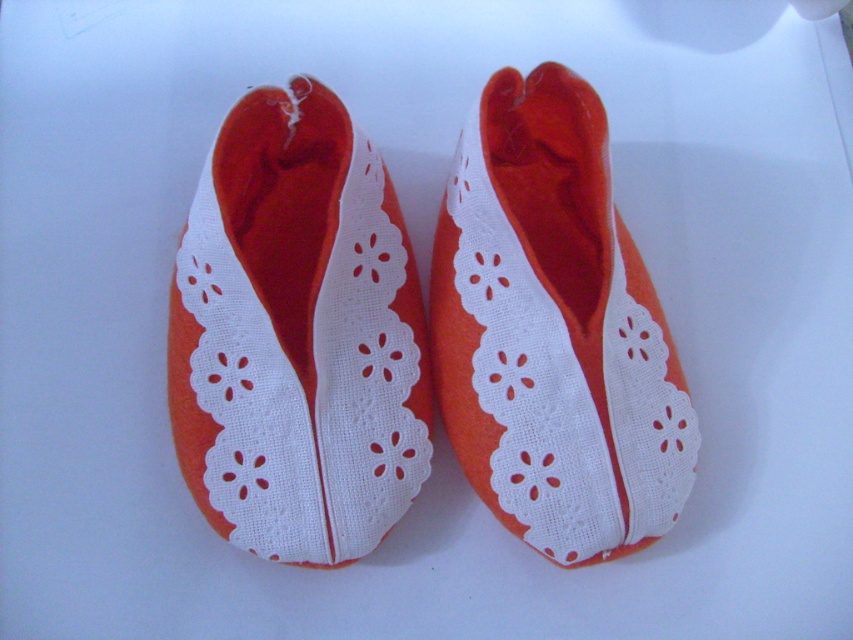
Looking at this image, you are organizing a shoe rack and see the orange fabric shoe at center and the orange felt slipper at center. Which one is positioned to the left side?

The orange fabric shoe at center is to the left of orange felt slipper at center.

You are a delivery person trying to place a small package between the orange fabric shoe at center and the orange felt slipper at center. Based on their positions, can you fit the package between them?

The orange fabric shoe at center is in front of orange felt slipper at center, so there is space between them for the package to be placed.

Please look at the image and identify the object located at the coordinates point (297, 336). What is it?

The point (297, 336) marks the orange fabric shoe at center.